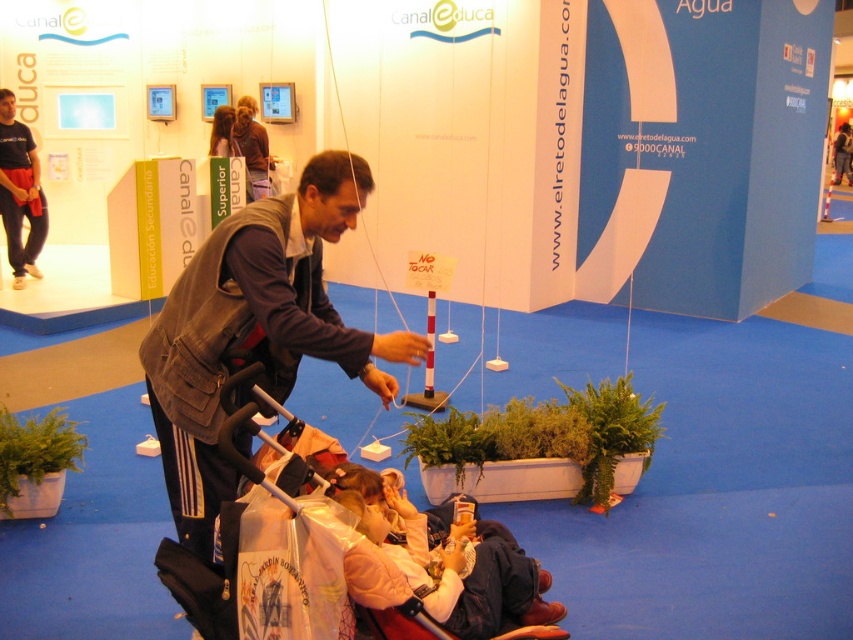
Question: Which of the following is the farthest from the observer?

Choices:
 (A) (30, 157)
 (B) (241, 99)

Answer: (B)

Question: Based on their relative distances, which object is nearer to the light pink fabric at lower center?

Choices:
 (A) brown leather jacket at upper center
 (B) matte black pants at left

Answer: (A)

Question: Which object appears closest to the camera in this image?

Choices:
 (A) light pink fabric at lower center
 (B) matte black pants at left
 (C) black plastic baby carriage at lower center
 (D) brown leather jacket at upper center

Answer: (C)

Question: Can you confirm if black plastic baby carriage at lower center is positioned above brown leather jacket at upper center?

Choices:
 (A) yes
 (B) no

Answer: (B)

Question: Can you confirm if light pink fabric at lower center is positioned to the right of brown leather jacket at upper center?

Choices:
 (A) yes
 (B) no

Answer: (A)

Question: Does matte black pants at left have a larger size compared to brown leather jacket at upper center?

Choices:
 (A) no
 (B) yes

Answer: (B)